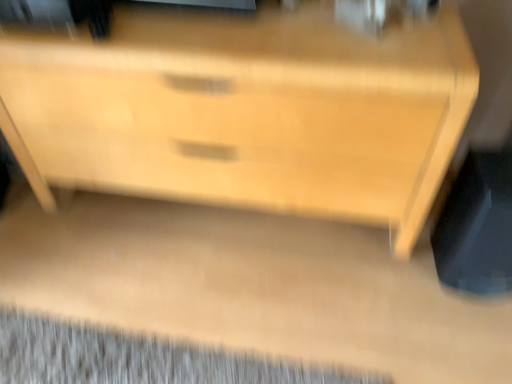
Question: Considering the positions of point (28, 178) and point (160, 347), is point (28, 178) closer or farther from the camera than point (160, 347)?

Choices:
 (A) closer
 (B) farther

Answer: (B)

Question: In the image, is light wood chest of drawers at center positioned in front of or behind gray textured mat at lower left?

Choices:
 (A) behind
 (B) front

Answer: (B)

Question: Based on their relative distances, which object is nearer to the light wood chest of drawers at center?

Choices:
 (A) black plastic swivel chair at lower right
 (B) gray textured mat at lower left

Answer: (A)

Question: Estimate the real-world distances between objects in this image. Which object is closer to the light wood chest of drawers at center?

Choices:
 (A) gray textured mat at lower left
 (B) black plastic swivel chair at lower right

Answer: (B)